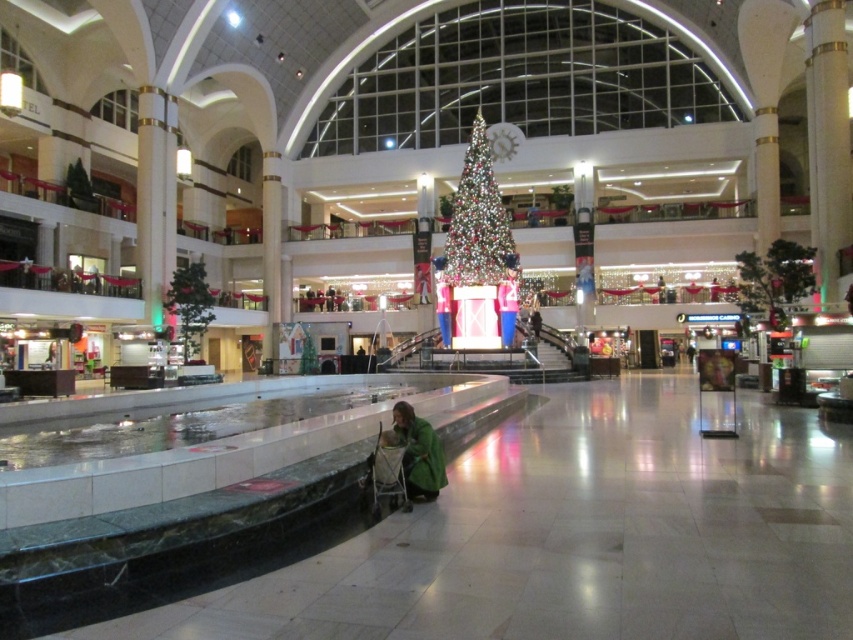
Can you confirm if iridescent glass christmas tree at center is positioned below green fabric at center?

Actually, iridescent glass christmas tree at center is above green fabric at center.

Who is shorter, iridescent glass christmas tree at center or green fabric at center?

green fabric at center

This screenshot has height=640, width=853. Find the location of `iridescent glass christmas tree at center`. iridescent glass christmas tree at center is located at coordinates (477, 221).

Find the location of a particular element. iridescent glass christmas tree at center is located at coordinates (477, 221).